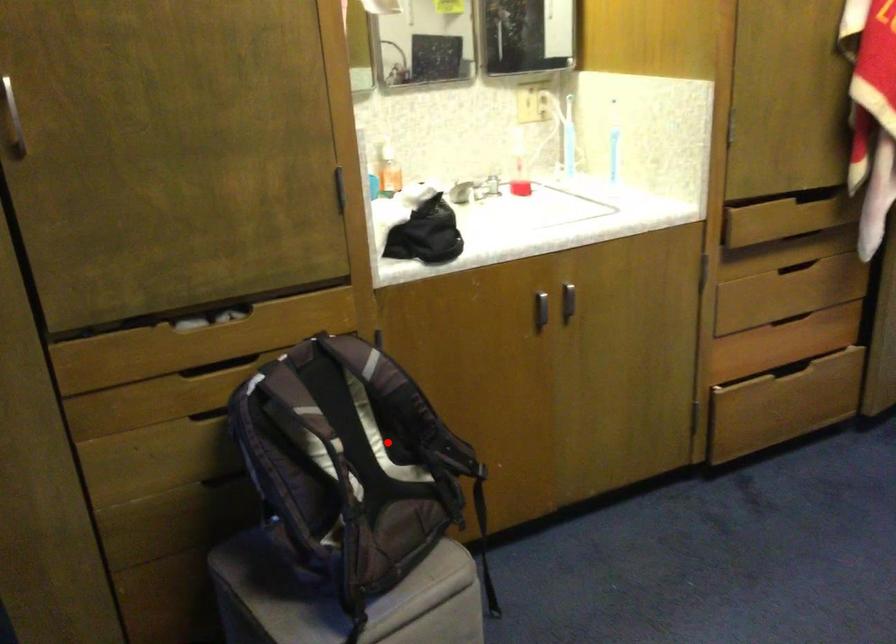
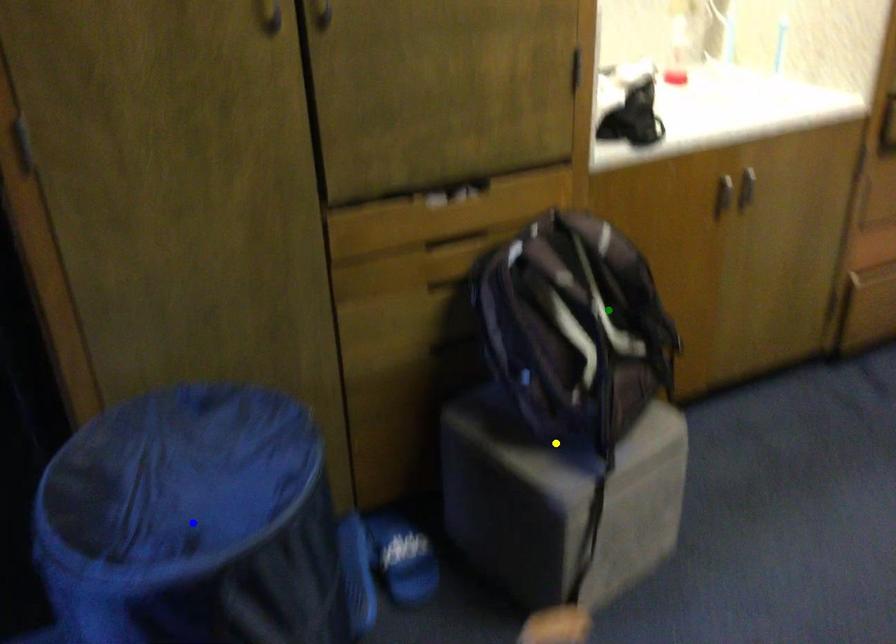
Question: I am providing you with two images of the same scene from different viewpoints. A red point is marked on the first image. You are given multiple points on the second image. In image 2, which mark is for the same physical point as the one in image 1?

Choices:
 (A) green point
 (B) blue point
 (C) yellow point

Answer: (A)